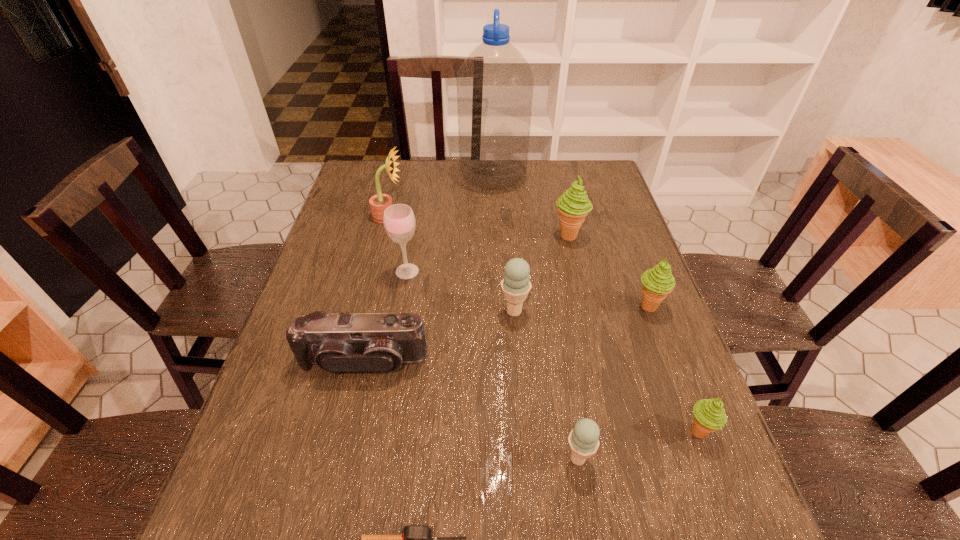
Locate an element on the screen. The height and width of the screenshot is (540, 960). free space between the nearest green icecream and the smaller blue ice cream is located at coordinates (637, 445).

Locate an element on the screen. This screenshot has height=540, width=960. vacant point located between the seventh nearest object and the right blue ice cream is located at coordinates (492, 364).

This screenshot has width=960, height=540. I want to click on vacant point located between the nearest green icecream and the wineglass, so click(x=553, y=352).

Locate an element on the screen. vacant space that is in between the camcorder and the tallest object is located at coordinates (428, 269).

What are the coordinates of `free area in between the second biggest green icecream and the camcorder` in the screenshot? It's located at (506, 334).

Find the location of a particular element. The width and height of the screenshot is (960, 540). free spot between the blue water jug and the nearest green icecream is located at coordinates (595, 304).

At what (x,y) coordinates should I click in order to perform the action: click on vacant space that's between the second farthest green icecream and the third icecream from left to right. Please return your answer as a coordinate pair (x, y). This screenshot has width=960, height=540. Looking at the image, I should click on (609, 271).

Locate an element on the screen. This screenshot has width=960, height=540. object that is the third closest to the sunflower is located at coordinates (516, 284).

You are a GUI agent. You are given a task and a screenshot of the screen. Output one action in this format:
    pyautogui.click(x=<x>, y=<y>)
    Task: Click on the seventh closest object to the nearest green icecream
    This screenshot has height=540, width=960.
    Given the screenshot: What is the action you would take?
    pyautogui.click(x=399, y=221)

You are a GUI agent. You are given a task and a screenshot of the screen. Output one action in this format:
    pyautogui.click(x=<x>, y=<y>)
    Task: Click on the icecream that is the second closest one to the yellow sunflower
    
    Given the screenshot: What is the action you would take?
    pyautogui.click(x=573, y=206)